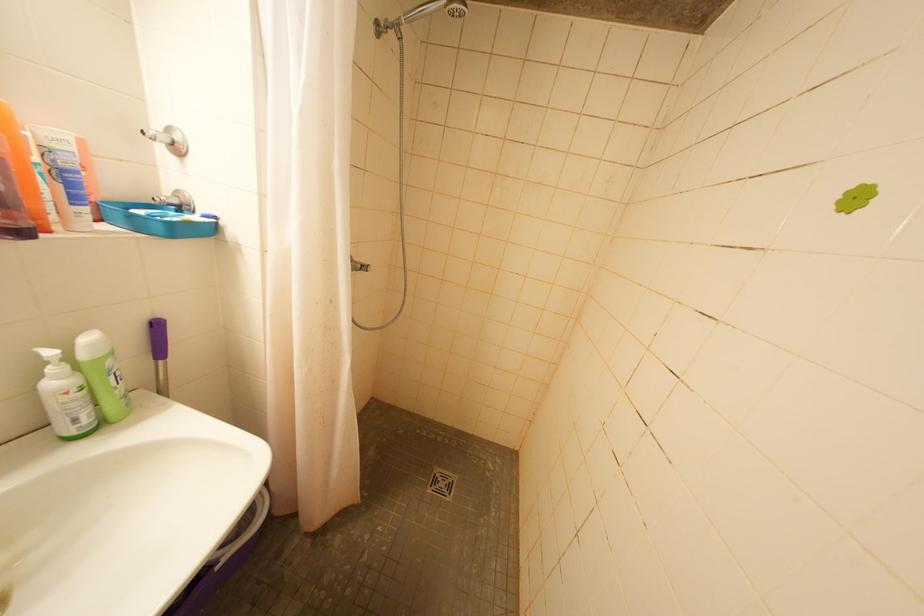
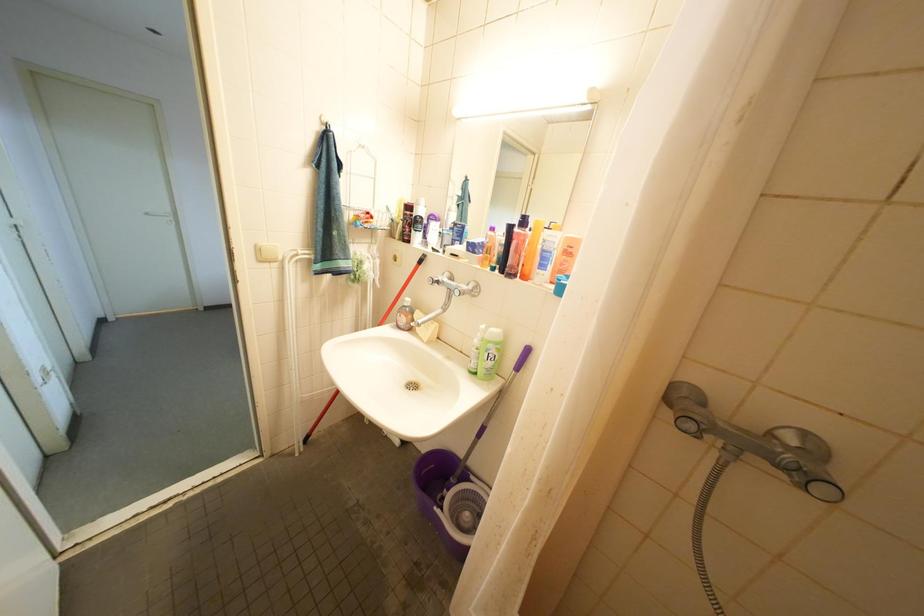
How did the camera likely rotate?

The rotation direction of the camera is left-down.